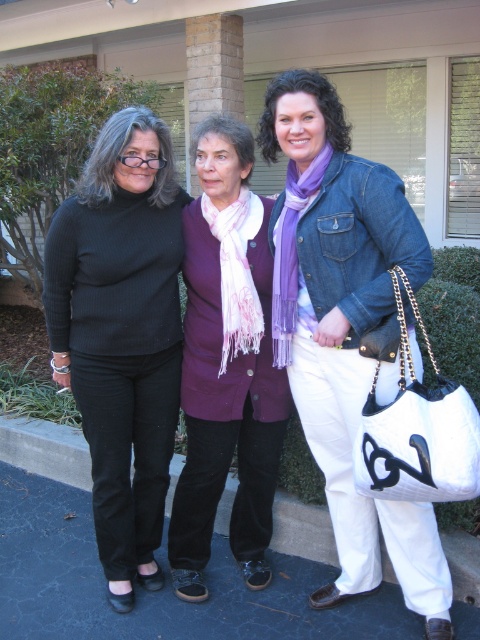
Between denim jacket at center and ribbed black sweater at left, which one appears on the right side from the viewer's perspective?

Positioned to the right is denim jacket at center.

Is denim jacket at center closer to camera compared to ribbed black sweater at left?

Yes, it is in front of ribbed black sweater at left.

This screenshot has width=480, height=640. Identify the location of denim jacket at center. (346, 330).

Which is behind, point (315, 282) or point (193, 525)?

The point (193, 525) is more distant.

This screenshot has width=480, height=640. Find the location of `denim jacket at center`. denim jacket at center is located at coordinates (346, 330).

Does ribbed black sweater at left have a greater width compared to purple cotton scarf at center?

Yes.

Is point (117, 342) positioned behind point (187, 227)?

No, (117, 342) is closer to viewer.

The height and width of the screenshot is (640, 480). I want to click on ribbed black sweater at left, so click(x=121, y=333).